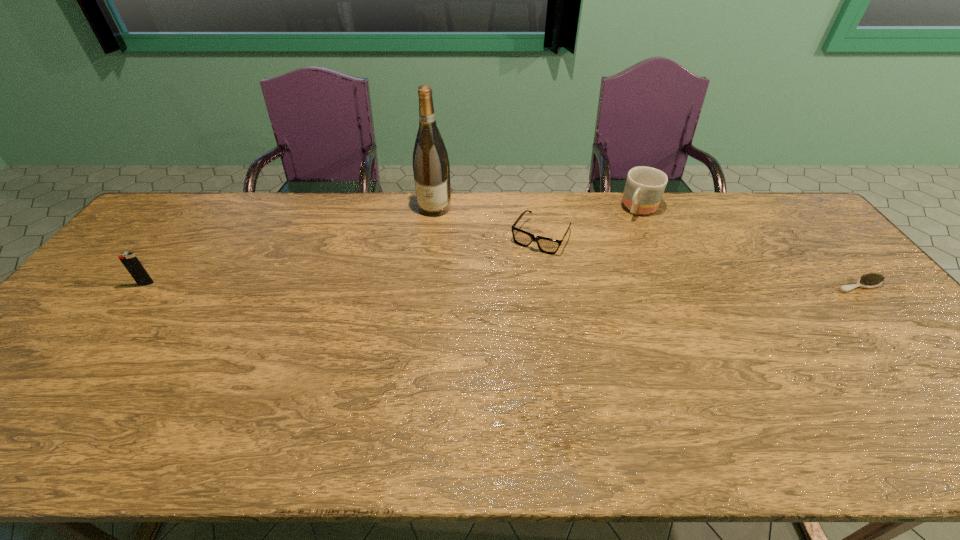
Identify the location of the second closest object to the second object from right to left. (871, 280).

This screenshot has width=960, height=540. I want to click on vacant point that satisfies the following two spatial constraints: 1. on the front side of the scrubbing brush; 2. on the left side of the tallest object, so click(425, 286).

The image size is (960, 540). Find the location of `vacant point that satisfies the following two spatial constraints: 1. on the front side of the fourth object from left to right; 2. on the left side of the rightmost object`. vacant point that satisfies the following two spatial constraints: 1. on the front side of the fourth object from left to right; 2. on the left side of the rightmost object is located at coordinates (674, 286).

The width and height of the screenshot is (960, 540). I want to click on free location that satisfies the following two spatial constraints: 1. on the front side of the fourth tallest object; 2. on the right side of the shortest object, so click(548, 286).